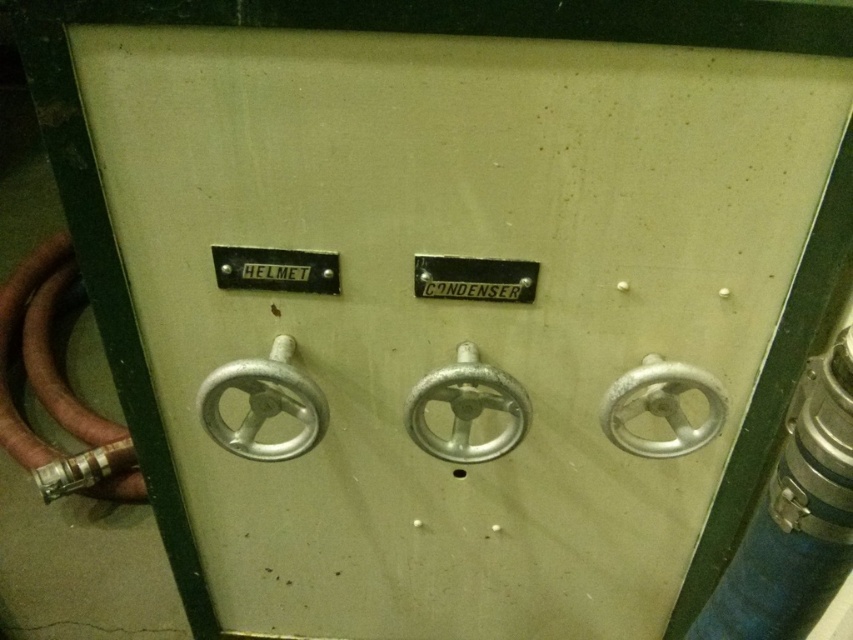
You are a technician who needs to adjust the metallic silver valve at right during a maintenance check. Given that your reach extends 30 inches from your body, can you comfortably adjust it without moving your position?

The metallic silver valve at right is 34.40 inches away from the camera, which is beyond your 30 inches reach. You need to move closer or use a tool to adjust it.

You are standing 6 feet away from the control panel. If you want to reach the point at coordinates point (x=428, y=432), which is 38.05 inches from you, will you be able to touch it without moving closer?

The point at coordinates point (x=428, y=432) is 38.05 inches from you, which is approximately 3.17 feet. Since you are standing 6 feet away from the control panel, you cannot reach it without moving closer.

You are an engineer inspecting the control panel. You need to adjust the metallic knob at center and the matte metal helmet at upper left. Which one requires a wider grip due to its size?

The metallic knob at center requires a wider grip because it has a larger size compared to the matte metal helmet at upper left.